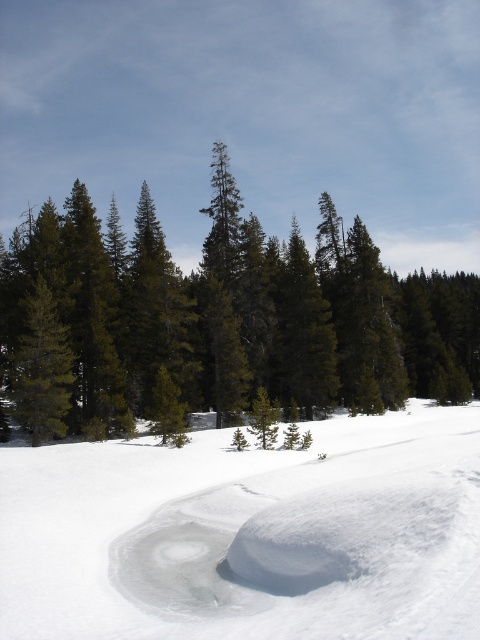
You are a hiker who needs to cross the distance between the white snow at center and the green matte tree at left. Your backpack has a rope that is 8 meters long. Do you think the rope is long enough to bridge the gap between them?

The distance between the white snow at center and the green matte tree at left is 8.59 meters. Since the rope is only 8 meters long, it is not long enough to bridge the gap between them.